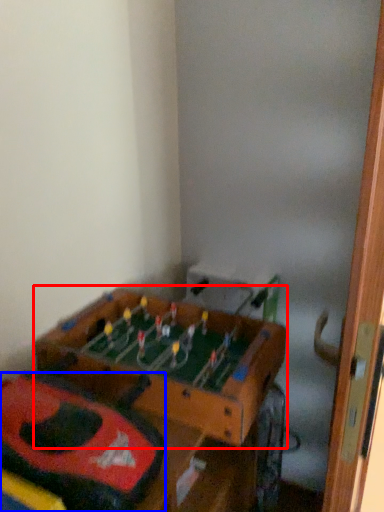
Question: Which object appears closest to the camera in this image, table (highlighted by a red box) or kit (highlighted by a blue box)?

Choices:
 (A) table
 (B) kit

Answer: (B)